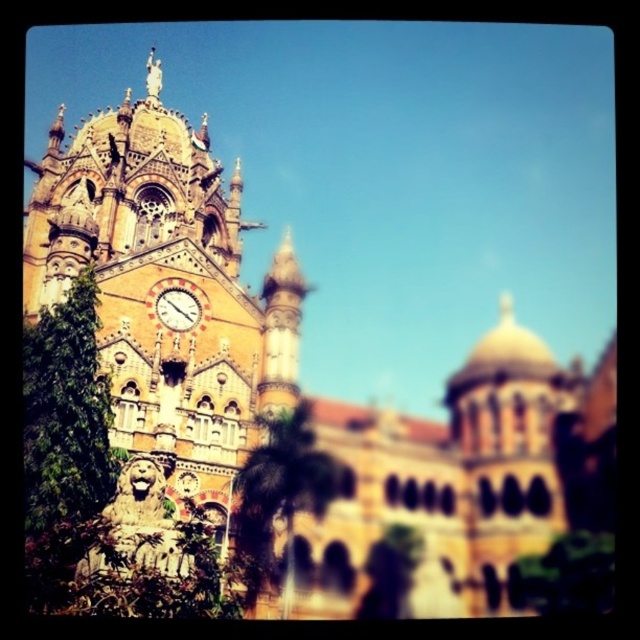
Question: Which of the following is the closest to the observer?

Choices:
 (A) (195, 317)
 (B) (401, 528)
 (C) (24, 436)

Answer: (C)

Question: Observing the image, what is the correct spatial positioning of green leafy tree at center in reference to metallic clock face at center?

Choices:
 (A) right
 (B) left

Answer: (A)

Question: Can you confirm if green leafy tree at center is bigger than green leafy tree at lower center?

Choices:
 (A) no
 (B) yes

Answer: (B)

Question: Is green leafy tree at left to the right of metallic clock face at center from the viewer's perspective?

Choices:
 (A) no
 (B) yes

Answer: (A)

Question: Estimate the real-world distances between objects in this image. Which object is farther from the green leafy tree at center?

Choices:
 (A) green leafy tree at lower right
 (B) green leafy tree at lower center
 (C) metallic clock face at center
 (D) green leafy tree at left

Answer: (A)

Question: Which point is farther to the camera?

Choices:
 (A) (269, 481)
 (B) (186, 326)

Answer: (B)